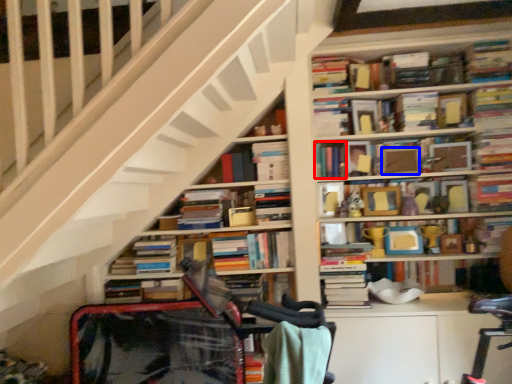
Question: Which object appears farthest to the camera in this image, book (highlighted by a red box) or paperback book (highlighted by a blue box)?

Choices:
 (A) book
 (B) paperback book

Answer: (B)